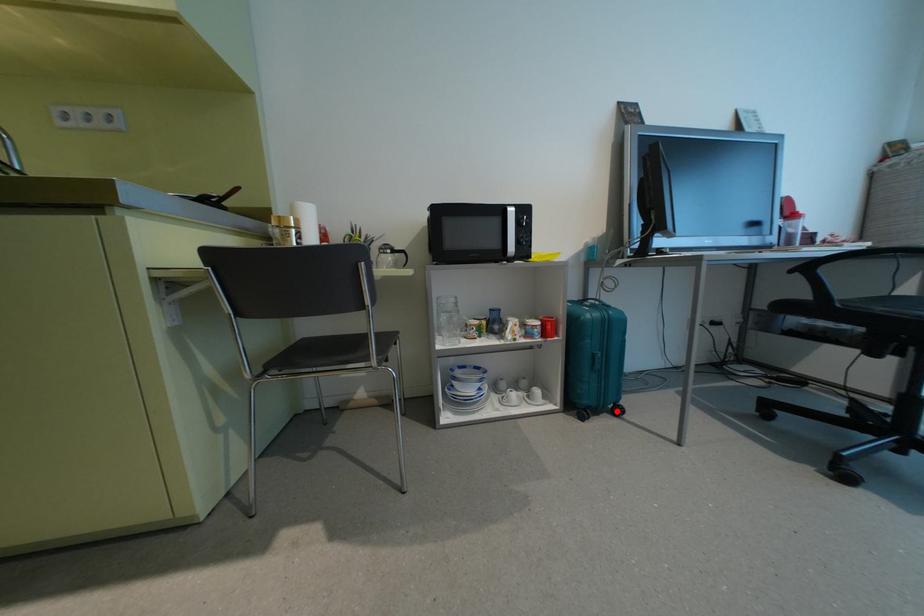
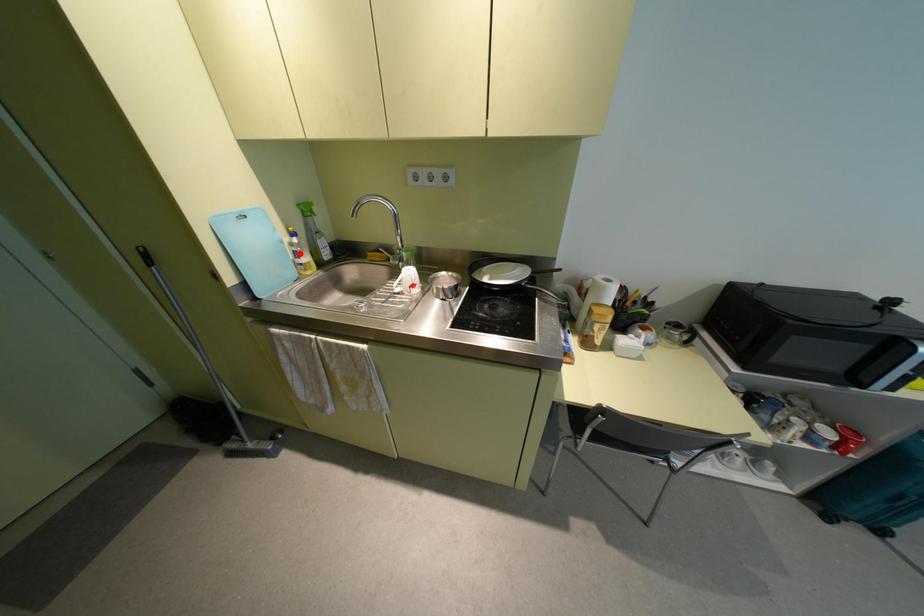
In the scene shown: I am providing you with two images of the same scene from different viewpoints. A red point is marked on the first image and another point is marked on the second image. Are the points marked in image1 and image2 representing the same 3D position?

No